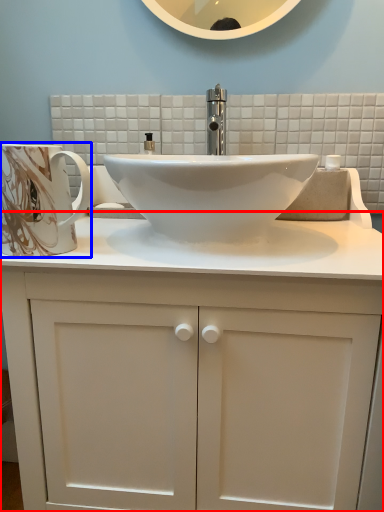
Question: Which point is further to the camera, bathroom cabinet (highlighted by a red box) or mug (highlighted by a blue box)?

Choices:
 (A) bathroom cabinet
 (B) mug

Answer: (B)